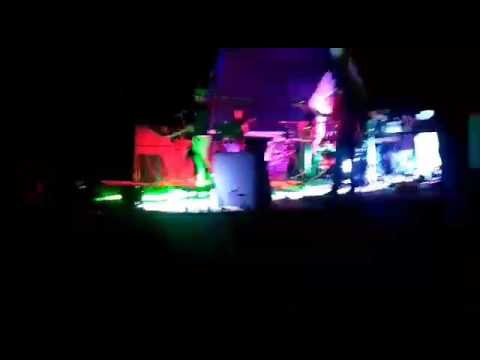
Identify the location of bright lights. (196, 129), (242, 185), (400, 147), (313, 114).